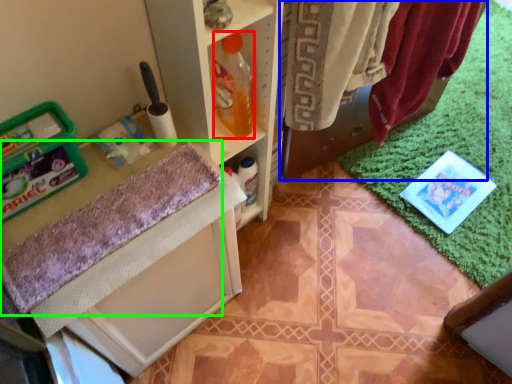
Question: Based on their relative distances, which object is nearer to bottle (highlighted by a red box)? Choose from laundry (highlighted by a blue box) and bath towel (highlighted by a green box).

Choices:
 (A) laundry
 (B) bath towel

Answer: (B)